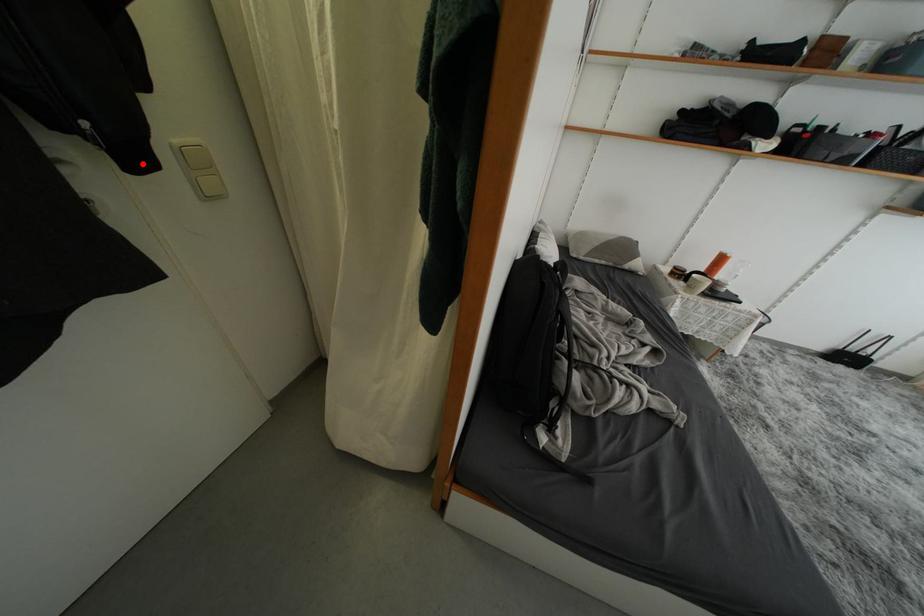
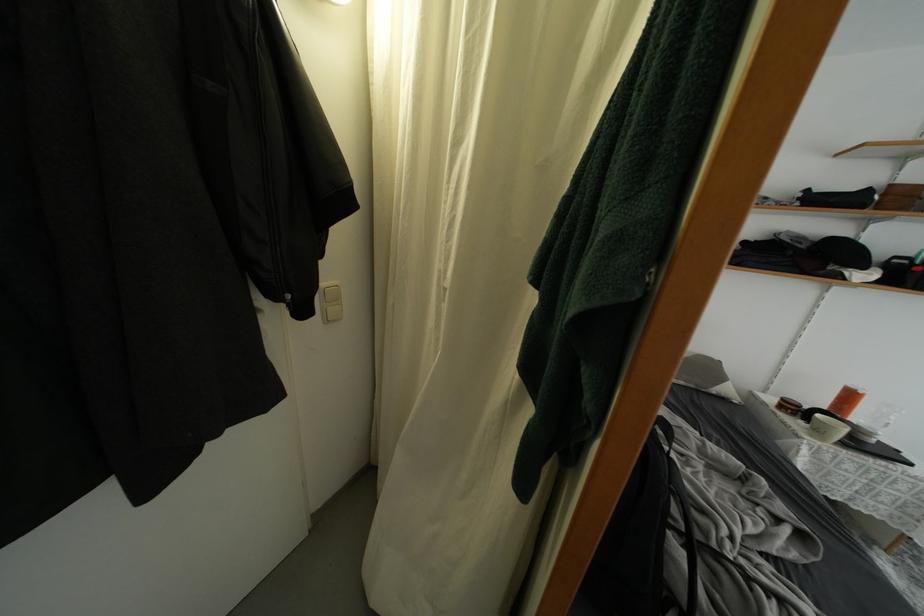
Question: A red point is marked in image1. In image2, is the corresponding 3D point closer to the camera or farther? Reply with the corresponding letter.

Choices:
 (A) The corresponding 3D point is closer.
 (B) The corresponding 3D point is farther.

Answer: (A)